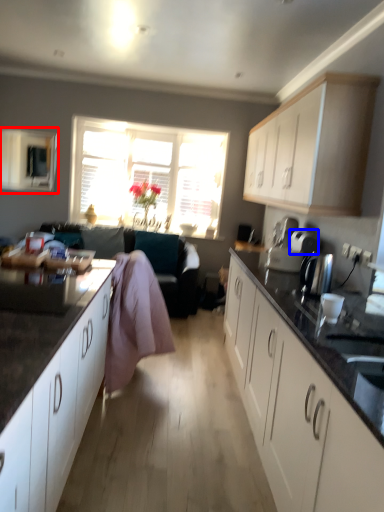
Question: Which of the following is the farthest to the observer, window screen (highlighted by a red box) or appliance (highlighted by a blue box)?

Choices:
 (A) window screen
 (B) appliance

Answer: (A)